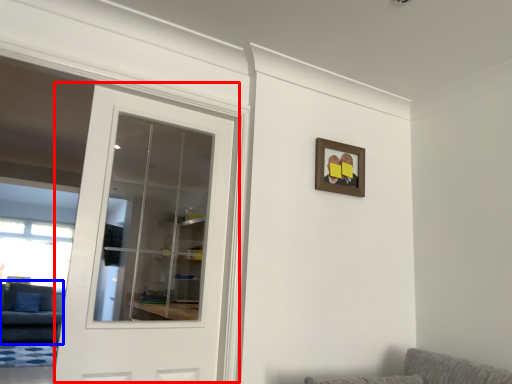
Question: Which point is further to the camera, door (highlighted by a red box) or couch (highlighted by a blue box)?

Choices:
 (A) door
 (B) couch

Answer: (B)